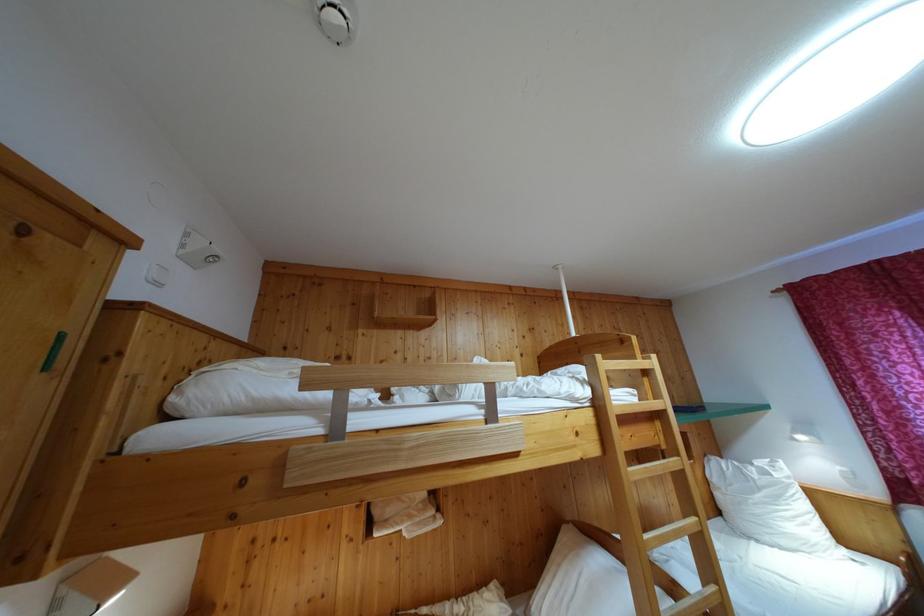
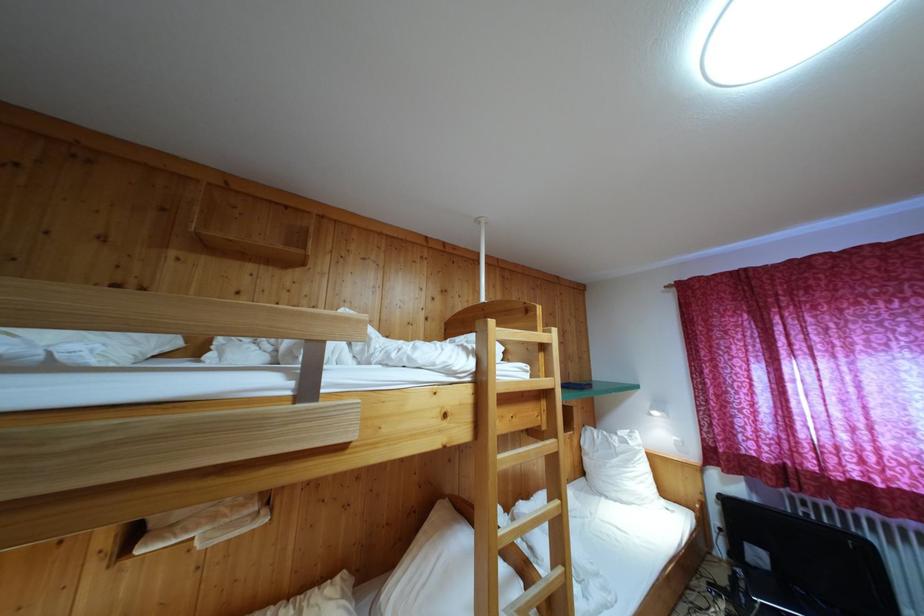
What movement of the cameraman would produce the second image?

The cameraman walked toward right, forward.